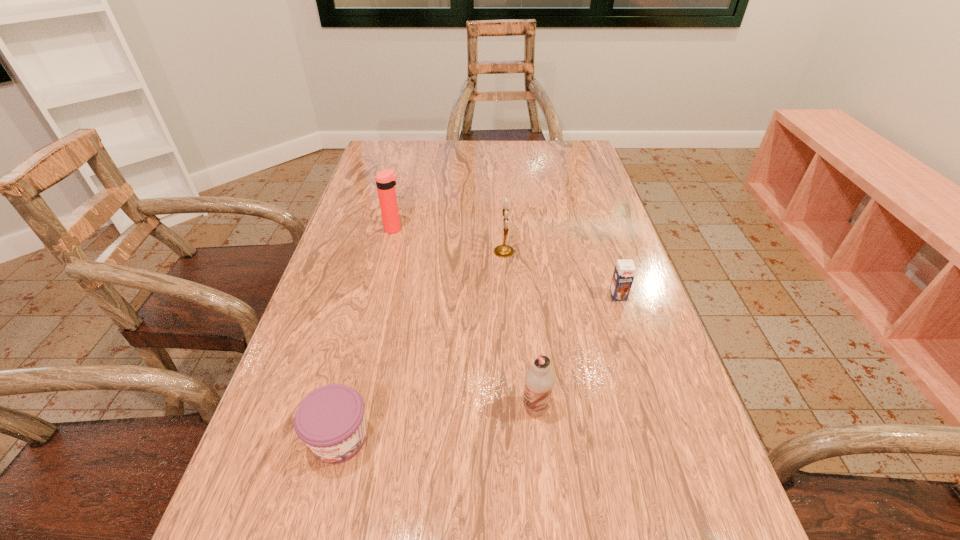
You are a GUI agent. You are given a task and a screenshot of the screen. Output one action in this format:
    pyautogui.click(x=<x>, y=<y>)
    Task: Click on the vacant region between the second farthest object and the taller chocolate milk
    
    Given the screenshot: What is the action you would take?
    pyautogui.click(x=519, y=329)

You are a GUI agent. You are given a task and a screenshot of the screen. Output one action in this format:
    pyautogui.click(x=<x>, y=<y>)
    Task: Click on the free space that is in between the jam and the farthest object
    
    Given the screenshot: What is the action you would take?
    pyautogui.click(x=367, y=334)

You are a GUI agent. You are given a task and a screenshot of the screen. Output one action in this format:
    pyautogui.click(x=<x>, y=<y>)
    Task: Click on the free space between the thermos bottle and the candelabrum
    
    Given the screenshot: What is the action you would take?
    pyautogui.click(x=449, y=240)

Find the location of a particular element. The image size is (960, 540). vacant area that lies between the right chocolate milk and the candelabrum is located at coordinates (561, 274).

This screenshot has height=540, width=960. I want to click on empty space between the left chocolate milk and the farthest object, so click(x=465, y=318).

Where is `blank region between the jam and the thermos bottle`? This screenshot has height=540, width=960. blank region between the jam and the thermos bottle is located at coordinates (367, 334).

At what (x,y) coordinates should I click in order to perform the action: click on empty location between the third shortest object and the farthest object. Please return your answer as a coordinate pair (x, y). Looking at the image, I should click on (465, 318).

Choose which object is the fourth nearest neighbor to the farthest object. Please provide its 2D coordinates. Your answer should be formatted as a tuple, i.e. [(x, y)], where the tuple contains the x and y coordinates of a point satisfying the conditions above.

[(539, 380)]

Where is `object that is the fourth closest to the farthest object`? object that is the fourth closest to the farthest object is located at coordinates (539, 380).